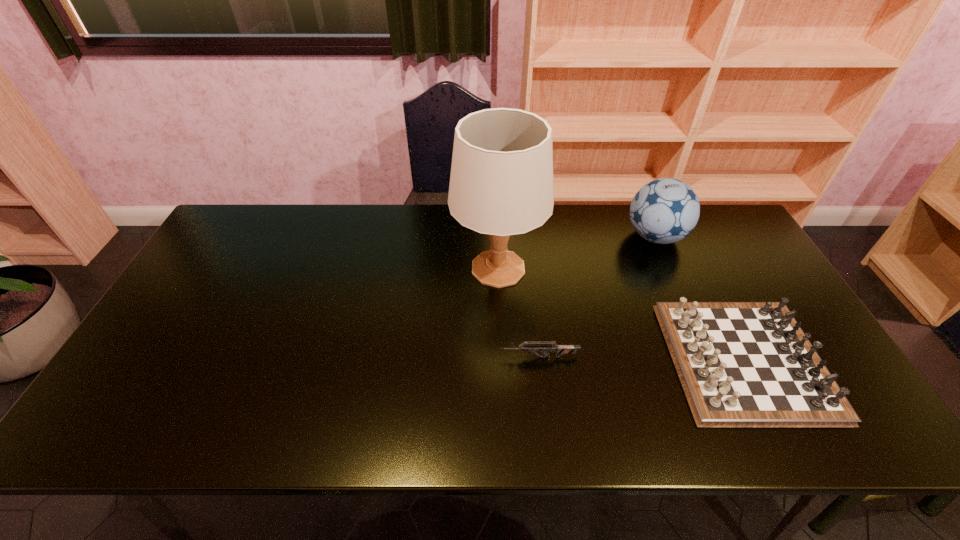
At what (x,y) coordinates should I click in order to perform the action: click on blank space located 0.100m from the player's perspective of the chessboard. Please return your answer as a coordinate pair (x, y). The height and width of the screenshot is (540, 960). Looking at the image, I should click on (633, 360).

This screenshot has height=540, width=960. In order to click on vacant area situated 0.290m aimed along the barrel of the shortest object in this screenshot , I will do `click(385, 357)`.

This screenshot has width=960, height=540. I want to click on blank space located 0.050m aimed along the barrel of the shortest object, so click(480, 357).

Find the location of a particular element. vacant area located aimed along the barrel of the shortest object is located at coordinates (377, 357).

Locate an element on the screen. The height and width of the screenshot is (540, 960). table lamp that is at the far edge is located at coordinates (x=501, y=183).

Locate an element on the screen. The width and height of the screenshot is (960, 540). soccer ball situated at the far edge is located at coordinates (665, 210).

Locate an element on the screen. The image size is (960, 540). object positioned at the near edge is located at coordinates (741, 364).

Identify the location of object that is positioned at the right edge. (741, 364).

Where is `object at the near right corner`? object at the near right corner is located at coordinates (741, 364).

This screenshot has height=540, width=960. In the image, there is a desktop. In order to click on vacant space at the far edge in this screenshot , I will do `click(320, 204)`.